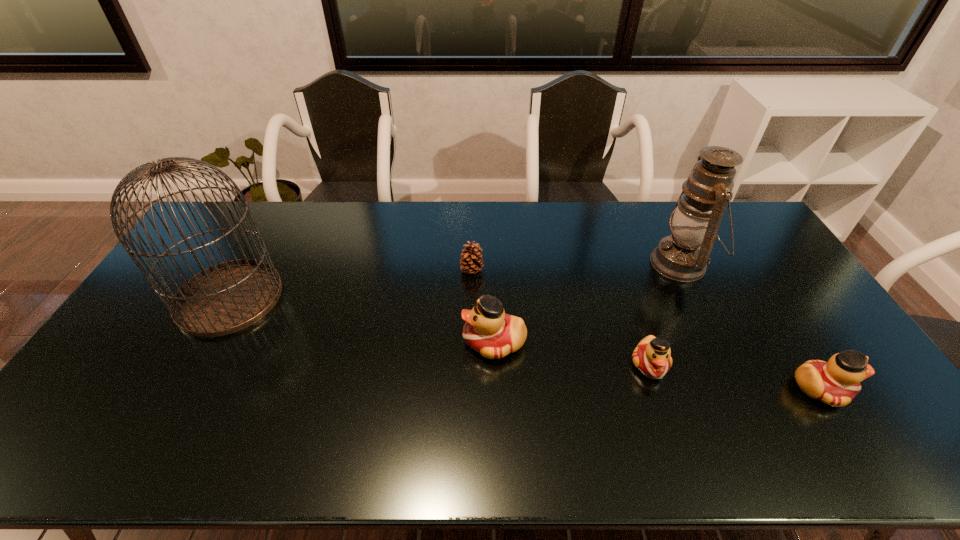
Where is `unoccupied area between the leftmost duck and the shortest duck`? unoccupied area between the leftmost duck and the shortest duck is located at coordinates (572, 353).

This screenshot has height=540, width=960. Find the location of `empty space between the leftmost object and the second shortest duck`. empty space between the leftmost object and the second shortest duck is located at coordinates (525, 343).

This screenshot has width=960, height=540. What are the coordinates of `vacant point located between the fifth object from left to right and the second shortest duck` in the screenshot? It's located at (751, 326).

This screenshot has width=960, height=540. Identify the location of free space between the rightmost object and the pinecone. (646, 329).

At what (x,y) coordinates should I click in order to perform the action: click on free space between the rightmost object and the second object from right to left. Please return your answer as a coordinate pair (x, y). The image size is (960, 540). Looking at the image, I should click on (751, 326).

In order to click on free space between the birdcage and the fourth shortest object in this screenshot , I will do `click(362, 320)`.

Find the location of a particular element. This screenshot has height=540, width=960. unoccupied area between the oil lamp and the second tallest duck is located at coordinates point(751,326).

The image size is (960, 540). What are the coordinates of `object that is the fifth closest to the fourth shortest object` in the screenshot? It's located at (836, 382).

Select which object is the second closest to the fifth object from left to right. Please provide its 2D coordinates. Your answer should be formatted as a tuple, i.e. [(x, y)], where the tuple contains the x and y coordinates of a point satisfying the conditions above.

[(836, 382)]

Identify which duck is located as the nearest to the leftmost duck. Please provide its 2D coordinates. Your answer should be formatted as a tuple, i.e. [(x, y)], where the tuple contains the x and y coordinates of a point satisfying the conditions above.

[(652, 357)]